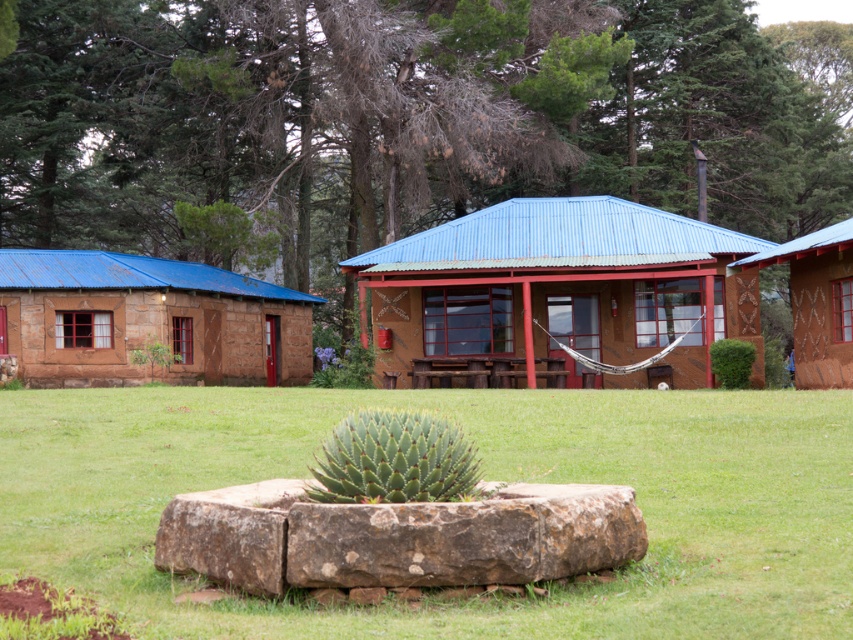
Consider the image. Between brown clay cabin at center and brown textured cabin at right, which one is positioned higher?

Positioned higher is brown textured cabin at right.

Which is more to the right, brown clay cabin at center or brown textured cabin at right?

Positioned to the right is brown textured cabin at right.

Does point (610, 209) lie behind point (816, 369)?

Yes, point (610, 209) is behind point (816, 369).

Identify the location of brown clay cabin at center. (561, 285).

Is green grass at center to the left of brown textured cabin at right from the viewer's perspective?

Correct, you'll find green grass at center to the left of brown textured cabin at right.

Is green grass at center to the right of brown textured cabin at right from the viewer's perspective?

No, green grass at center is not to the right of brown textured cabin at right.

Identify the location of green grass at center. The width and height of the screenshot is (853, 640). (485, 476).

Can you confirm if green grass at center is bigger than rustic stone cabin at left?

Actually, green grass at center might be smaller than rustic stone cabin at left.

Consider the image. Is green grass at center wider than rustic stone cabin at left?

Yes.

Which is in front, point (693, 406) or point (201, 381)?

Point (693, 406) is more forward.

Where is `green grass at center`? The image size is (853, 640). green grass at center is located at coordinates (485, 476).